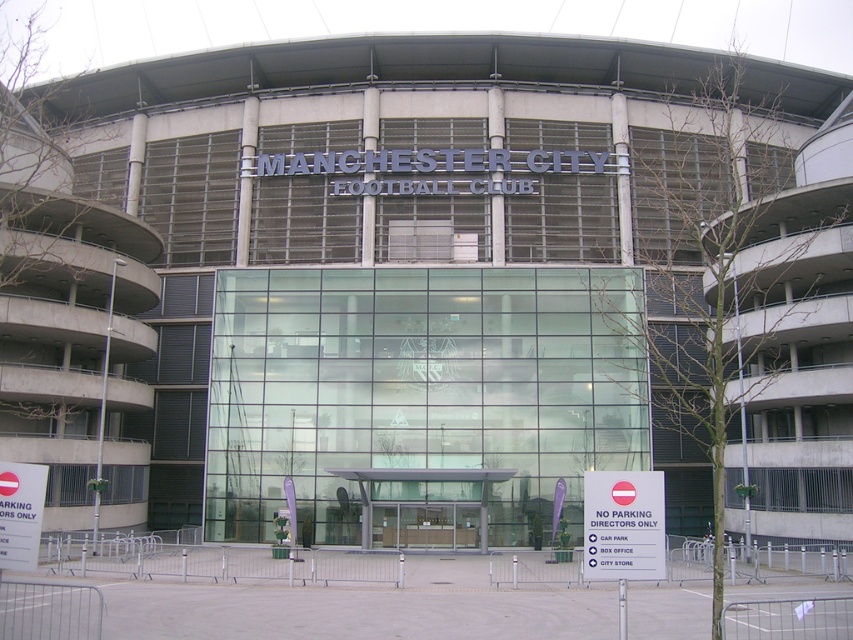
Consider the image. You are standing at the entrance of Manchester City Football Club and notice a point marked at coordinates (624, 525). What object is located at this point?

The point at coordinates (624, 525) corresponds to the white plastic sign at lower right.